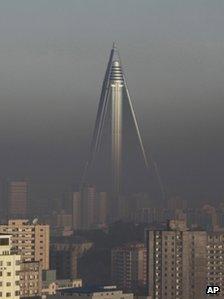
Find the location of `window`. window is located at coordinates (33, 237).